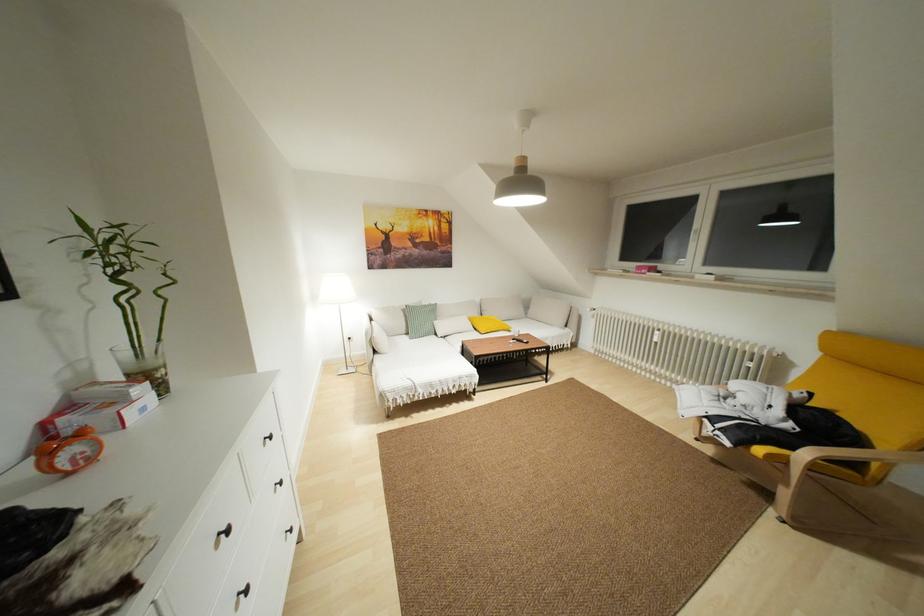
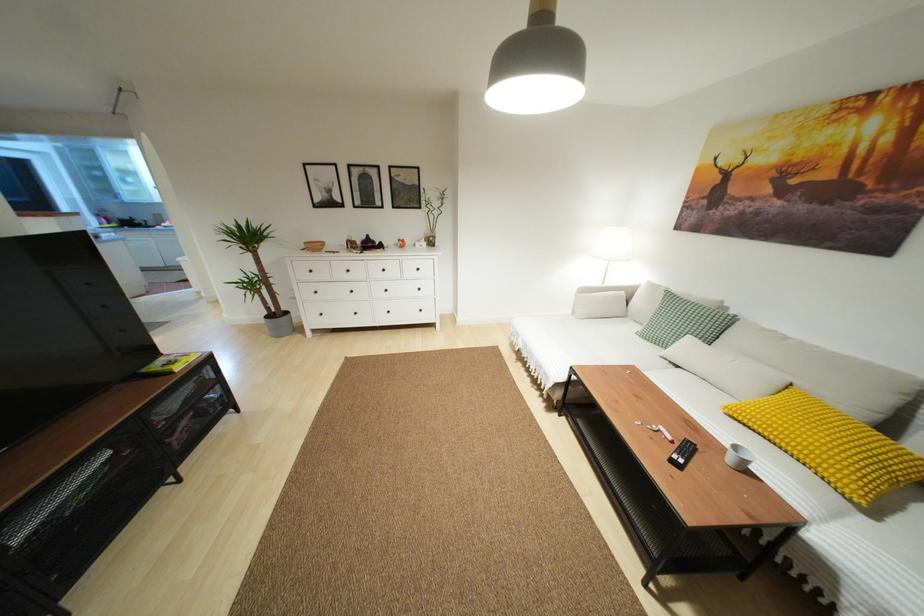
The point at (270, 437) is marked in the first image. Where is the corresponding point in the second image?

(418, 268)